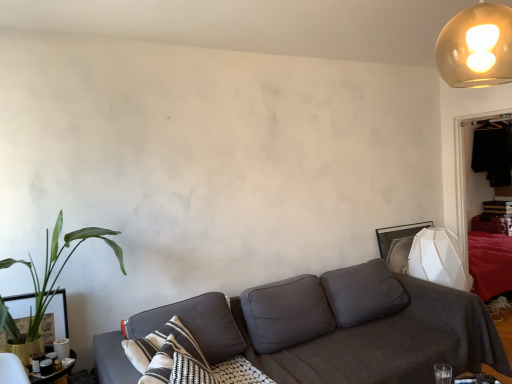
Question: From the image's perspective, is green leafy plant at left above dark gray fabric pillow at center?

Choices:
 (A) yes
 (B) no

Answer: (A)

Question: Can you confirm if green leafy plant at left is shorter than dark gray fabric pillow at center?

Choices:
 (A) no
 (B) yes

Answer: (A)

Question: Is green leafy plant at left positioned with its back to dark gray fabric pillow at center?

Choices:
 (A) no
 (B) yes

Answer: (A)

Question: Considering the relative positions of green leafy plant at left and dark gray fabric pillow at center in the image provided, is green leafy plant at left to the left of dark gray fabric pillow at center from the viewer's perspective?

Choices:
 (A) yes
 (B) no

Answer: (A)

Question: Does green leafy plant at left turn towards dark gray fabric pillow at center?

Choices:
 (A) yes
 (B) no

Answer: (B)

Question: Is the depth of green leafy plant at left greater than that of dark gray fabric pillow at center?

Choices:
 (A) no
 (B) yes

Answer: (B)

Question: Can you confirm if dark gray fabric couch at center is shorter than dark gray fabric pillow at center?

Choices:
 (A) yes
 (B) no

Answer: (B)

Question: Does dark gray fabric couch at center have a smaller size compared to dark gray fabric pillow at center?

Choices:
 (A) yes
 (B) no

Answer: (B)

Question: Would you say dark gray fabric couch at center is a long distance from dark gray fabric pillow at center?

Choices:
 (A) no
 (B) yes

Answer: (A)

Question: Does dark gray fabric couch at center have a larger size compared to dark gray fabric pillow at center?

Choices:
 (A) yes
 (B) no

Answer: (A)

Question: Is dark gray fabric couch at center outside dark gray fabric pillow at center?

Choices:
 (A) yes
 (B) no

Answer: (A)

Question: Can you confirm if dark gray fabric couch at center is taller than dark gray fabric pillow at center?

Choices:
 (A) no
 (B) yes

Answer: (B)

Question: Is translucent glass globe at upper right thinner than dark brown wooden dresser at right?

Choices:
 (A) no
 (B) yes

Answer: (A)